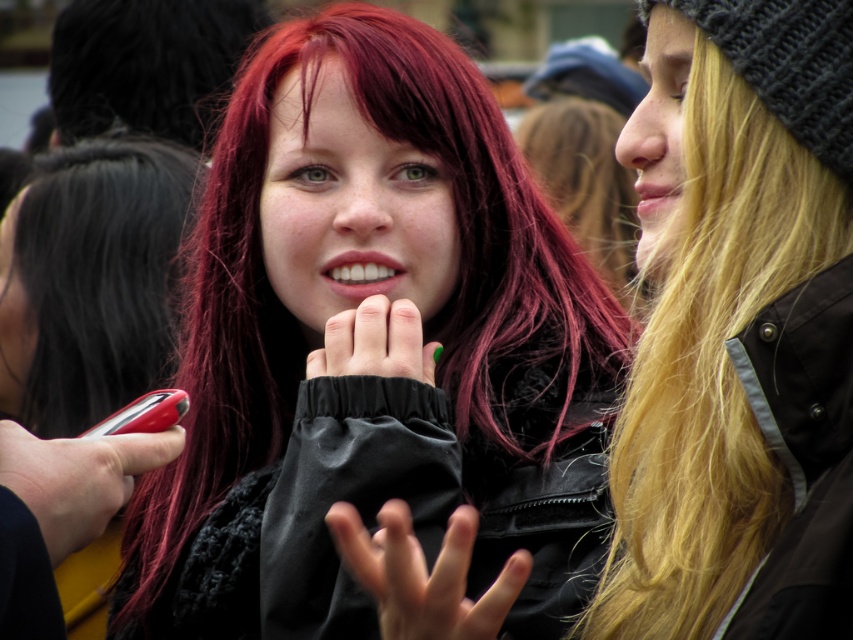
Describe the element at coordinates (91, 280) in the screenshot. I see `dark red silky hair at center` at that location.

Which is above, dark red silky hair at center or smooth black hand at center?

Positioned higher is dark red silky hair at center.

You are a GUI agent. You are given a task and a screenshot of the screen. Output one action in this format:
    pyautogui.click(x=<x>, y=<y>)
    Task: Click on the dark red silky hair at center
    The width and height of the screenshot is (853, 640).
    Given the screenshot: What is the action you would take?
    pyautogui.click(x=91, y=280)

Who is shorter, blonde hair at right or shiny black hair at upper left?

With less height is shiny black hair at upper left.

Can you confirm if blonde hair at right is bigger than shiny black hair at upper left?

Actually, blonde hair at right might be smaller than shiny black hair at upper left.

Who is more distant from viewer, (x=759, y=291) or (x=175, y=108)?

Positioned behind is point (x=175, y=108).

The width and height of the screenshot is (853, 640). What are the coordinates of `blonde hair at right` in the screenshot? It's located at (738, 330).

Is dark red silky hair at center smaller than green matte nails at center?

Actually, dark red silky hair at center might be larger than green matte nails at center.

Does dark red silky hair at center appear under green matte nails at center?

No.

Does point (172, 317) come closer to viewer compared to point (380, 369)?

No, (172, 317) is further to viewer.

Locate an element on the screen. The height and width of the screenshot is (640, 853). dark red silky hair at center is located at coordinates point(91,280).